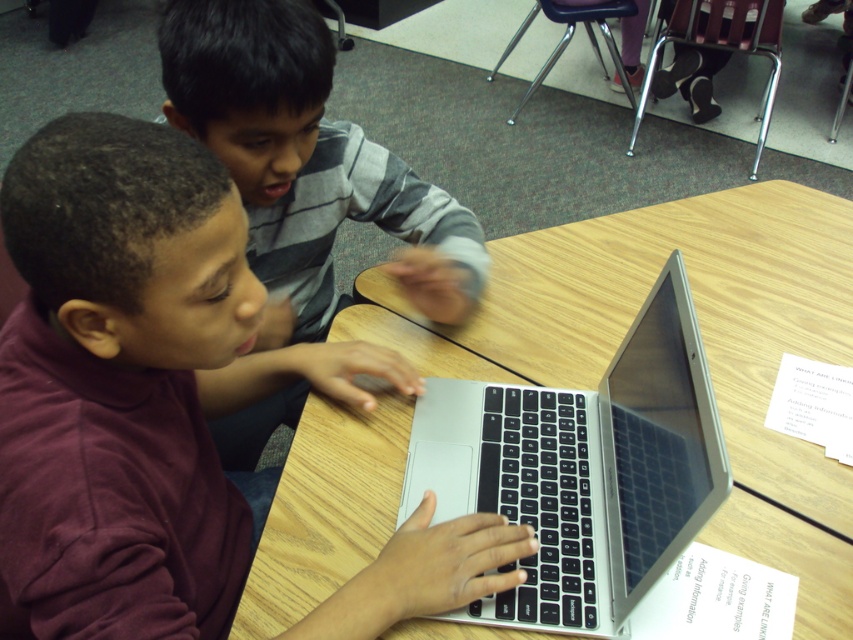
Question: Does wooden table at center come in front of silver metallic laptop at center?

Choices:
 (A) yes
 (B) no

Answer: (B)

Question: Is wooden table at center further to camera compared to gray striped sweater at upper center?

Choices:
 (A) no
 (B) yes

Answer: (A)

Question: Which point is farther to the camera?

Choices:
 (A) (537, 268)
 (B) (140, 284)

Answer: (A)

Question: Which point is farther from the camera taking this photo?

Choices:
 (A) (244, 422)
 (B) (561, 620)

Answer: (A)

Question: Does wooden table at center have a greater width compared to gray striped sweater at upper center?

Choices:
 (A) no
 (B) yes

Answer: (B)

Question: Which of these objects is positioned farthest from the wooden table at center?

Choices:
 (A) maroon fabric shirt at lower left
 (B) gray striped sweater at upper center
 (C) silver metallic laptop at center

Answer: (A)